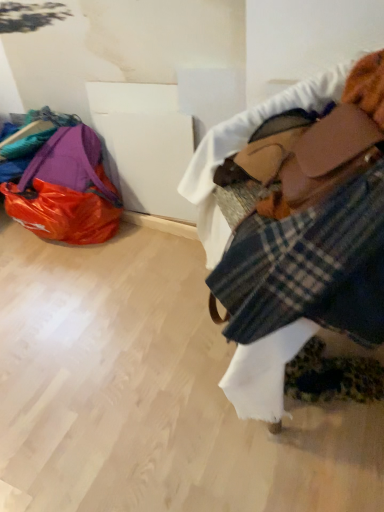
Question: In terms of size, does matte purple bag at left appear bigger or smaller than plaid fabric at upper right?

Choices:
 (A) small
 (B) big

Answer: (A)

Question: Based on their positions, is matte purple bag at left located to the left or right of plaid fabric at upper right?

Choices:
 (A) right
 (B) left

Answer: (B)

Question: Considering the real-world distances, which object is closest to the matte purple bag at left?

Choices:
 (A) plaid fabric at upper right
 (B) plaid fabric at right

Answer: (A)

Question: Estimate the real-world distances between objects in this image. Which object is closer to the plaid fabric at right?

Choices:
 (A) matte purple bag at left
 (B) plaid fabric at upper right

Answer: (B)